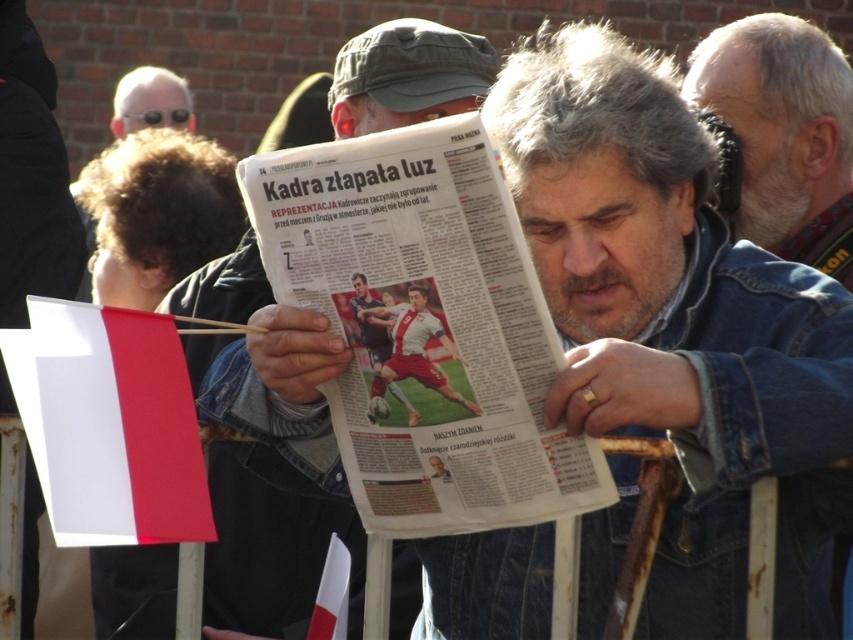
Question: Which point is closer to the camera?

Choices:
 (A) matte black sunglasses at upper left
 (B) white paper newspaper at center

Answer: (B)

Question: Is white paper flag at lower left bigger than white paper flag at lower center?

Choices:
 (A) yes
 (B) no

Answer: (A)

Question: Does white paper newspaper at center have a larger size compared to matte newspaper at center?

Choices:
 (A) no
 (B) yes

Answer: (A)

Question: Considering the relative positions of gray hair at upper right and white paper flag at lower center in the image provided, where is gray hair at upper right located with respect to white paper flag at lower center?

Choices:
 (A) below
 (B) above

Answer: (B)

Question: Which object is the farthest from the white paper flag at lower left?

Choices:
 (A) white paper newspaper at center
 (B) white paper flag at lower center

Answer: (B)

Question: Which point appears closest to the camera in this image?

Choices:
 (A) (346, 560)
 (B) (109, 420)
 (C) (821, 269)
 (D) (438, 513)

Answer: (B)